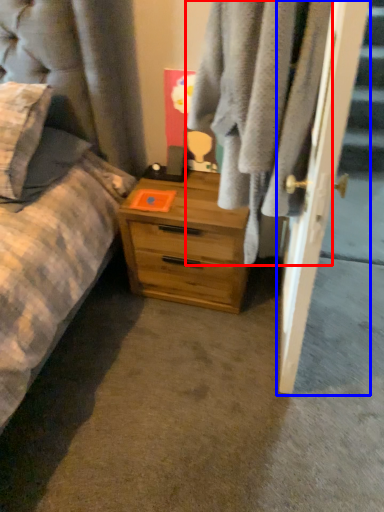
Question: Which object is closer to the camera taking this photo, clothing (highlighted by a red box) or door (highlighted by a blue box)?

Choices:
 (A) clothing
 (B) door

Answer: (A)